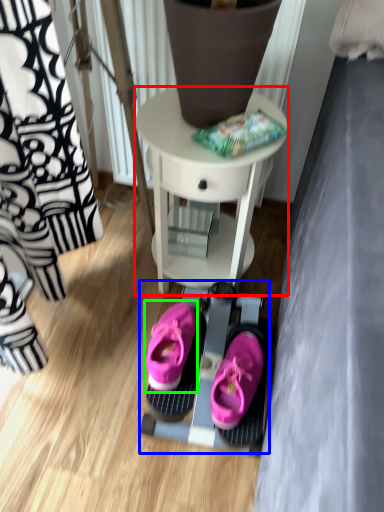
Question: Which object is the farthest from table (highlighted by a red box)? Choose among these: bunk bed (highlighted by a blue box) or footwear (highlighted by a green box).

Choices:
 (A) bunk bed
 (B) footwear

Answer: (B)